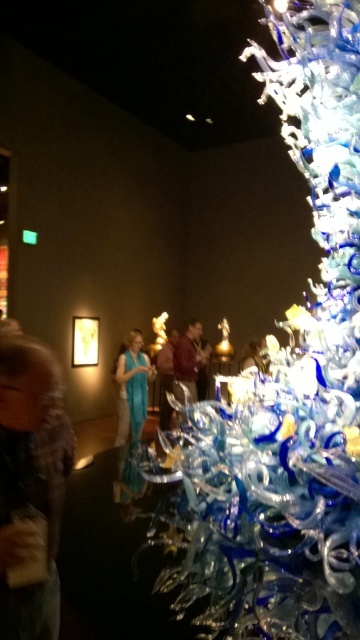
Who is positioned more to the left, matte black jacket at lower left or teal silk dress at center?

teal silk dress at center

Does matte black jacket at lower left appear over teal silk dress at center?

Indeed, matte black jacket at lower left is positioned over teal silk dress at center.

Is point (51, 435) positioned behind point (124, 406)?

No, (51, 435) is in front of (124, 406).

I want to click on matte black jacket at lower left, so [27, 483].

Measure the distance between matte black jacket at lower left and teal fabric dress at center.

A distance of 5.65 meters exists between matte black jacket at lower left and teal fabric dress at center.

Does matte black jacket at lower left have a lesser height compared to teal fabric dress at center?

Yes, matte black jacket at lower left is shorter than teal fabric dress at center.

Image resolution: width=360 pixels, height=640 pixels. In order to click on matte black jacket at lower left in this screenshot , I will do `click(27, 483)`.

I want to click on blue glass sculpture at right, so click(x=285, y=387).

Measure the distance between blue glass sculpture at right and camera.

They are 1.42 meters apart.

Which is in front, point (223, 417) or point (164, 371)?

Point (223, 417) is more forward.

The height and width of the screenshot is (640, 360). What are the coordinates of `blue glass sculpture at right` in the screenshot? It's located at (285, 387).